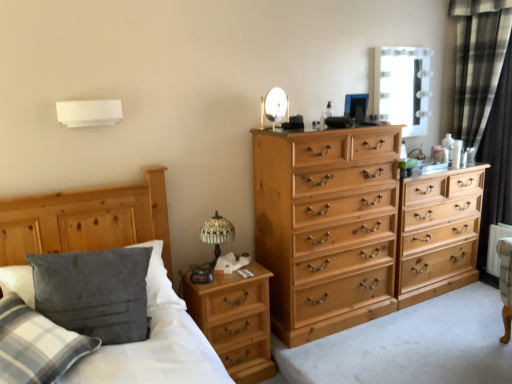
Question: Considering the relative sizes of black plaid curtain at right and stained glass table lamp at center left in the image provided, is black plaid curtain at right shorter than stained glass table lamp at center left?

Choices:
 (A) yes
 (B) no

Answer: (B)

Question: Is stained glass table lamp at center left completely or partially inside black plaid curtain at right?

Choices:
 (A) no
 (B) yes

Answer: (A)

Question: Can you confirm if black plaid curtain at right is thinner than stained glass table lamp at center left?

Choices:
 (A) no
 (B) yes

Answer: (A)

Question: From the image's perspective, is black plaid curtain at right below stained glass table lamp at center left?

Choices:
 (A) yes
 (B) no

Answer: (B)

Question: Is black plaid curtain at right positioned with its back to stained glass table lamp at center left?

Choices:
 (A) yes
 (B) no

Answer: (B)

Question: Is black plaid curtain at right to the right of stained glass table lamp at center left from the viewer's perspective?

Choices:
 (A) yes
 (B) no

Answer: (A)

Question: From a real-world perspective, is wooden bed frame at left physically above metallic round mirror at upper center?

Choices:
 (A) no
 (B) yes

Answer: (A)

Question: Is wooden bed frame at left bigger than metallic round mirror at upper center?

Choices:
 (A) yes
 (B) no

Answer: (A)

Question: Can we say wooden bed frame at left lies outside metallic round mirror at upper center?

Choices:
 (A) yes
 (B) no

Answer: (A)

Question: Considering the relative positions of wooden bed frame at left and metallic round mirror at upper center in the image provided, is wooden bed frame at left to the left of metallic round mirror at upper center from the viewer's perspective?

Choices:
 (A) no
 (B) yes

Answer: (B)

Question: From the image's perspective, does wooden bed frame at left appear higher than metallic round mirror at upper center?

Choices:
 (A) no
 (B) yes

Answer: (A)

Question: Is metallic round mirror at upper center a part of wooden bed frame at left?

Choices:
 (A) no
 (B) yes

Answer: (A)

Question: Is velvety gray pillow at lower left thinner than black plaid curtain at right?

Choices:
 (A) no
 (B) yes

Answer: (A)